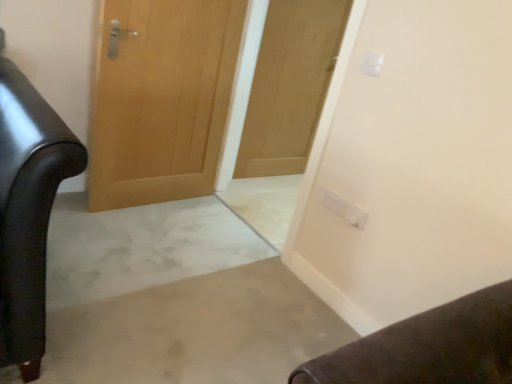
Question: In which direction should I rotate to look at white plastic electric outlet at upper center, the first electric outlet in the front-to-back sequence?

Choices:
 (A) left
 (B) right

Answer: (B)

Question: Is white plastic electric outlet at upper right, positioned as the 2th electric outlet in front-to-back order, positioned in front of wooden door at center, which is the 1th door in left-to-right order?

Choices:
 (A) yes
 (B) no

Answer: (B)

Question: Is white plastic electric outlet at upper right, positioned as the 2th electric outlet in front-to-back order, further to camera compared to wooden door at center, which is the 1th door in left-to-right order?

Choices:
 (A) yes
 (B) no

Answer: (A)

Question: From a real-world perspective, is white plastic electric outlet at upper right, marked as the third electric outlet in a top-to-bottom arrangement, located higher than wooden door at center, which is the 1th door in left-to-right order?

Choices:
 (A) no
 (B) yes

Answer: (A)

Question: Does white plastic electric outlet at upper right, the 1th electric outlet when ordered from bottom to top, appear on the left side of wooden door at center, which is the 1th door in left-to-right order?

Choices:
 (A) yes
 (B) no

Answer: (B)

Question: From the image's perspective, is white plastic electric outlet at upper right, acting as the 2th electric outlet starting from the back, on top of wooden door at center, the second door positioned from the right?

Choices:
 (A) no
 (B) yes

Answer: (A)

Question: Does white plastic electric outlet at upper right, positioned as the 2th electric outlet in front-to-back order, turn towards wooden door at center, which is the 1th door in left-to-right order?

Choices:
 (A) no
 (B) yes

Answer: (A)

Question: Does white plastic electric outlet at upper right, arranged as the third electric outlet when viewed from the front, come in front of wooden door at center, the second door positioned from the right?

Choices:
 (A) no
 (B) yes

Answer: (A)

Question: Is wooden door at center, the second door positioned from the right, at the back of white plastic electric outlet at upper right, acting as the 1th electric outlet starting from the back?

Choices:
 (A) no
 (B) yes

Answer: (A)

Question: Can you confirm if white plastic electric outlet at upper right, arranged as the third electric outlet when viewed from the front, is shorter than wooden door at center, the second door positioned from the right?

Choices:
 (A) no
 (B) yes

Answer: (B)

Question: From the image's perspective, is white plastic electric outlet at upper right, arranged as the 2th electric outlet when viewed from the top, on wooden door at center, the second door positioned from the right?

Choices:
 (A) no
 (B) yes

Answer: (A)

Question: From a real-world perspective, is white plastic electric outlet at upper right, the 2th electric outlet in the bottom-to-top sequence, beneath wooden door at center, the second door positioned from the right?

Choices:
 (A) yes
 (B) no

Answer: (A)

Question: Considering the relative positions of white plastic electric outlet at upper right, the 2th electric outlet in the bottom-to-top sequence, and wooden door at center, the second door positioned from the right, in the image provided, is white plastic electric outlet at upper right, the 2th electric outlet in the bottom-to-top sequence, to the left of wooden door at center, the second door positioned from the right, from the viewer's perspective?

Choices:
 (A) yes
 (B) no

Answer: (B)

Question: From a real-world perspective, is wooden door at center, which is the 1th door in left-to-right order, located beneath white plastic electric outlet at upper right, positioned as the 2th electric outlet in front-to-back order?

Choices:
 (A) yes
 (B) no

Answer: (B)